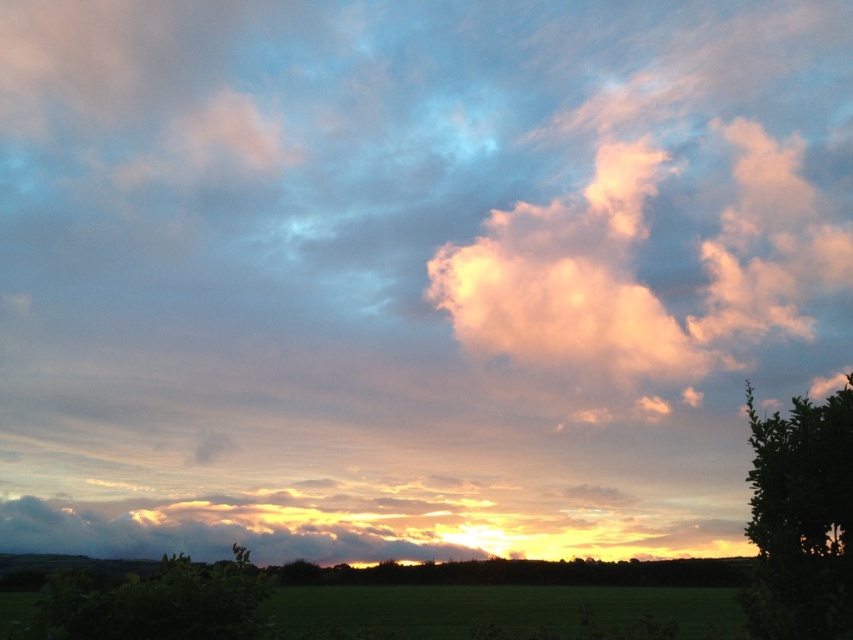
Which is in front, point (822, 445) or point (169, 637)?

Point (822, 445) is more forward.

Which is more to the right, green leafy tree at right or green leafy bush at lower left?

From the viewer's perspective, green leafy tree at right appears more on the right side.

Find the location of `green leafy tree at right`. green leafy tree at right is located at coordinates (801, 518).

The height and width of the screenshot is (640, 853). I want to click on green leafy tree at right, so click(801, 518).